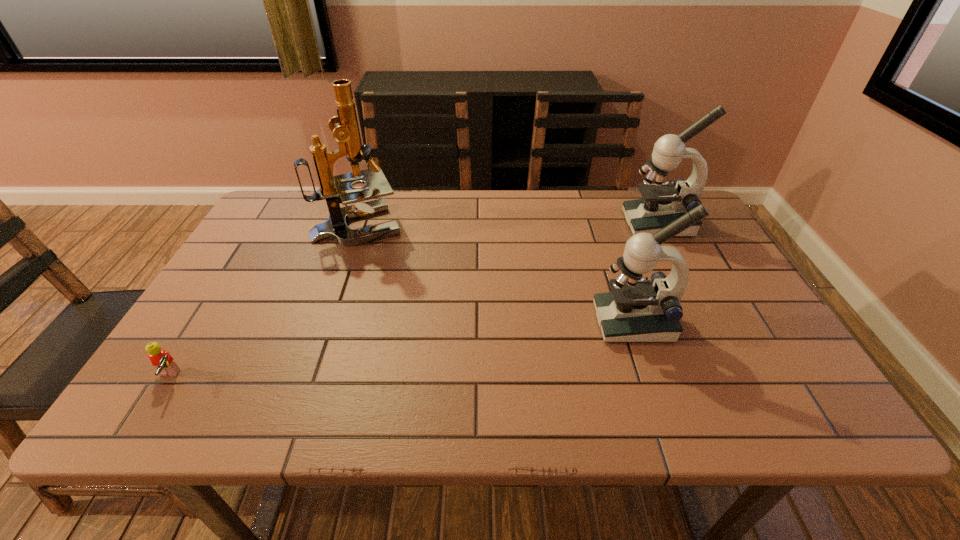
You are a GUI agent. You are given a task and a screenshot of the screen. Output one action in this format:
    pyautogui.click(x=<x>, y=<y>)
    Task: Click on the free space between the nearest microscope and the nearest object
    The height and width of the screenshot is (540, 960).
    Given the screenshot: What is the action you would take?
    pyautogui.click(x=400, y=350)

Find the location of `free space between the second object from left to right and the leftmost object`. free space between the second object from left to right and the leftmost object is located at coordinates (263, 302).

Where is `free space between the leftmost object and the third farthest object`? The image size is (960, 540). free space between the leftmost object and the third farthest object is located at coordinates (400, 350).

This screenshot has height=540, width=960. In order to click on free space that is in between the nearest microscope and the leftmost microscope in this screenshot , I will do `click(495, 273)`.

Where is `object that ranks as the second closest to the nearest object`? The height and width of the screenshot is (540, 960). object that ranks as the second closest to the nearest object is located at coordinates (636, 310).

Select which object is the second closest to the Lego. Please provide its 2D coordinates. Your answer should be formatted as a tuple, i.e. [(x, y)], where the tuple contains the x and y coordinates of a point satisfying the conditions above.

[(636, 310)]

Locate which microscope is the closest to the leftmost microscope. Please provide its 2D coordinates. Your answer should be formatted as a tuple, i.e. [(x, y)], where the tuple contains the x and y coordinates of a point satisfying the conditions above.

[(636, 310)]

Where is `the second closest microscope to the nearest microscope`? the second closest microscope to the nearest microscope is located at coordinates (338, 189).